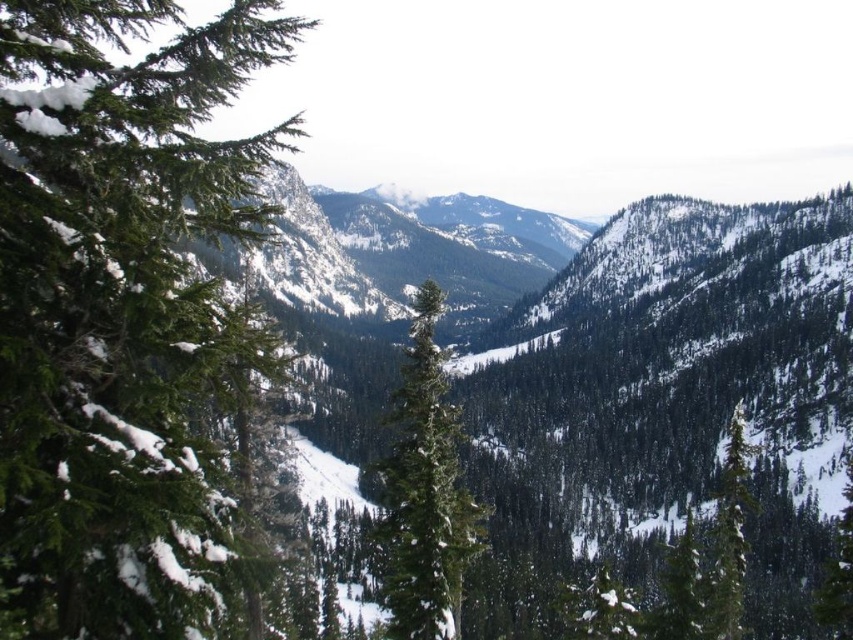
You are standing at the point labeled as point (x=115, y=308) in the image. Looking towards the mountains in the background, which object from the scene is directly behind you?

The green matte evergreen tree at left is directly behind you at point (x=115, y=308).

You are an environmental scientist analyzing the snow distribution in the valley. You notice the green matte evergreen tree at left and the green matte tree at right. Which tree has a larger width, and what might this indicate about the snow load they can support?

The green matte evergreen tree at left has a larger width than the green matte tree at right. This suggests that the green matte evergreen tree at left can support a greater snow load due to its wider structure, which provides more surface area for snow accumulation without bending or breaking.